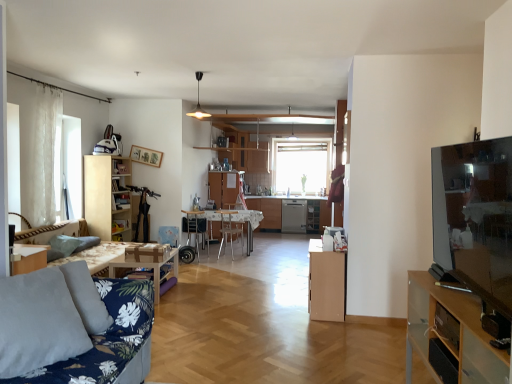
Question: From the image's perspective, is white glossy table at center, the second table from the left, located above or below wooden chair at center, arranged as the second chair when viewed from the right?

Choices:
 (A) above
 (B) below

Answer: (B)

Question: From a real-world perspective, is white glossy table at center, marked as the first table in a back-to-front arrangement, physically located above or below wooden chair at center, the 1th chair positioned from the left?

Choices:
 (A) below
 (B) above

Answer: (A)

Question: Which is farther from the wooden table at center, positioned as the 1th table in front-to-back order?

Choices:
 (A) metallic silver chair at center, which is the 2th chair from left to right
 (B) blue floral fabric couch at lower left
 (C) wooden picture frame at upper center
 (D) matte black tv at right
 (E) transparent glass tv stand at right, the 3th cabinetry when ordered from left to right

Answer: (A)

Question: Which of these objects is positioned closest to the white glossy table at center, which appears as the 2th table when viewed from the front?

Choices:
 (A) metallic silver chair at center, the first chair positioned from the right
 (B) white sheer curtain at left
 (C) light brown wood cabinet at center, the second cabinetry viewed from the back
 (D) light wood bookshelf at left, which ranks as the first cabinetry in left-to-right order
 (E) transparent glass tv stand at right, which is counted as the 3th cabinetry, starting from the back

Answer: (A)